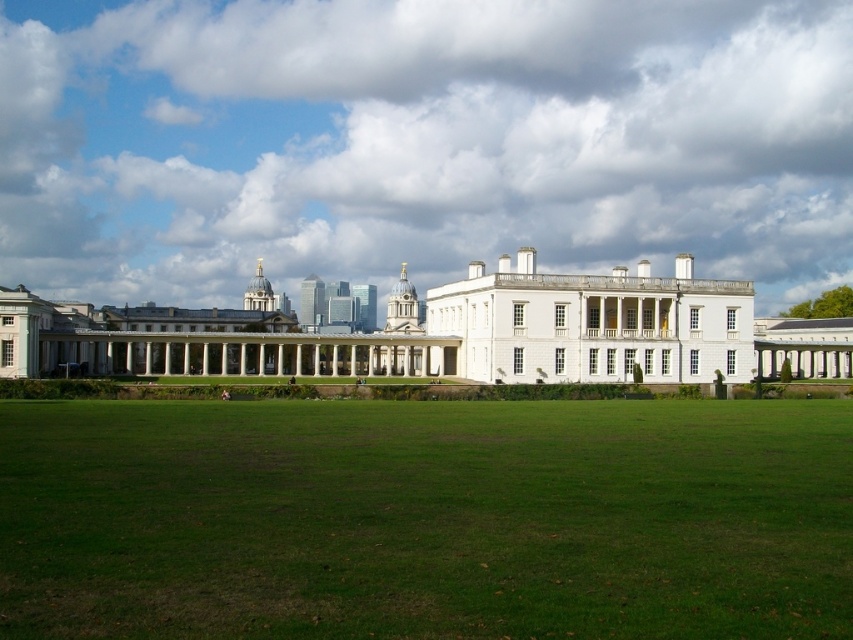
Between green grass at center and white glossy mansion at center, which one has less height?

Standing shorter between the two is green grass at center.

Does green grass at center appear on the right side of white glossy mansion at center?

Incorrect, green grass at center is not on the right side of white glossy mansion at center.

You are a GUI agent. You are given a task and a screenshot of the screen. Output one action in this format:
    pyautogui.click(x=<x>, y=<y>)
    Task: Click on the green grass at center
    Image resolution: width=853 pixels, height=640 pixels.
    Given the screenshot: What is the action you would take?
    pyautogui.click(x=425, y=518)